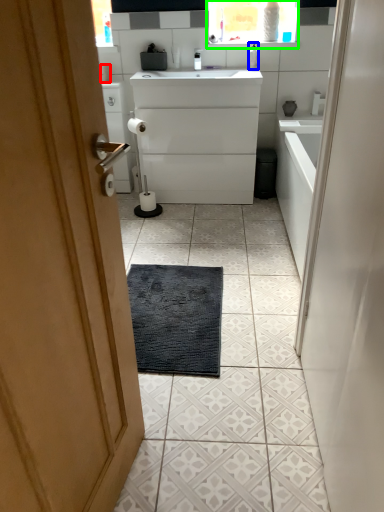
Question: Which object is the farthest from toilet paper (highlighted by a red box)? Choose among these: toiletry (highlighted by a blue box) or medicine cabinet (highlighted by a green box).

Choices:
 (A) toiletry
 (B) medicine cabinet

Answer: (B)